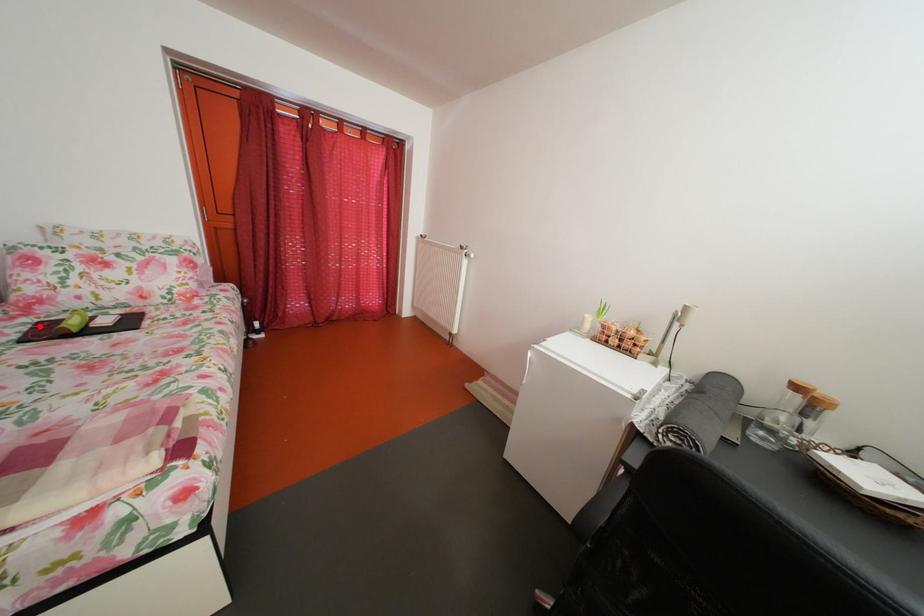
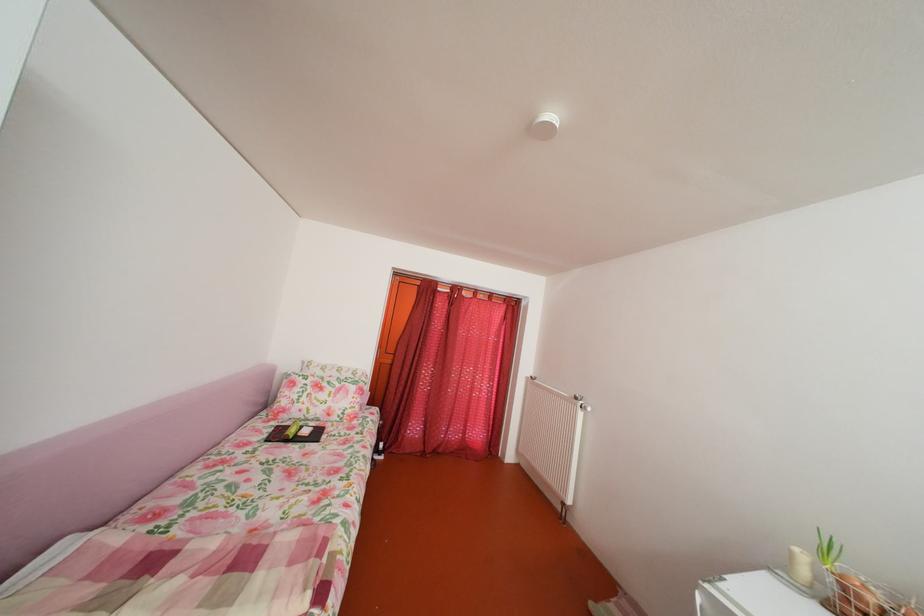
Find the pixel in the second image that matches the highlighted location in the first image.

(286, 430)